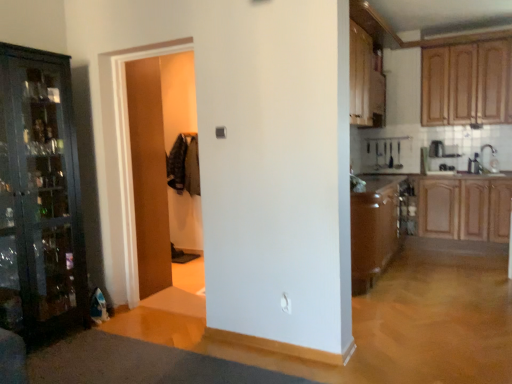
The width and height of the screenshot is (512, 384). In order to click on wooden door at center in this screenshot , I will do `click(149, 175)`.

Based on the photo, measure the distance between point [360,70] and camera.

4.04 meters.

What do you see at coordinates (366, 80) in the screenshot? I see `wooden cabinet at upper right, which is the second cabinetry in top-to-bottom order` at bounding box center [366, 80].

The height and width of the screenshot is (384, 512). What do you see at coordinates (467, 83) in the screenshot?
I see `wooden cabinets at upper right, the third cabinetry ordered from the bottom` at bounding box center [467, 83].

Find the location of a particular element. wooden cabinets at upper right, the third cabinetry ordered from the bottom is located at coordinates (467, 83).

Where is `wooden door at center`? The height and width of the screenshot is (384, 512). wooden door at center is located at coordinates (149, 175).

Is wooden door at center to the left or to the right of wooden cabinet at right, which is counted as the 3th cabinetry, starting from the top, in the image?

Clearly, wooden door at center is on the left of wooden cabinet at right, which is counted as the 3th cabinetry, starting from the top, in the image.

Are wooden door at center and wooden cabinet at right, which is counted as the 3th cabinetry, starting from the top, located far from each other?

Indeed, wooden door at center is not near wooden cabinet at right, which is counted as the 3th cabinetry, starting from the top.

Considering the sizes of objects wooden door at center and wooden cabinet at right, which is counted as the 3th cabinetry, starting from the top, in the image provided, who is shorter, wooden door at center or wooden cabinet at right, which is counted as the 3th cabinetry, starting from the top,?

With less height is wooden cabinet at right, which is counted as the 3th cabinetry, starting from the top.

Based on the photo, from the image's perspective, which object appears higher, wooden door at center or wooden cabinet at right, marked as the first cabinetry in a bottom-to-top arrangement?

wooden door at center, from the image's perspective.

Could you measure the distance between wooden door at center and wooden cabinet at upper right, which is the second cabinetry in top-to-bottom order?

wooden door at center and wooden cabinet at upper right, which is the second cabinetry in top-to-bottom order, are 6.67 feet apart.

From a real-world perspective, between wooden door at center and wooden cabinet at upper right, which is the second cabinetry in top-to-bottom order, who is vertically lower?

wooden door at center is physically lower.

Looking at this image, considering the relative sizes of wooden door at center and wooden cabinet at upper right, marked as the second cabinetry in a bottom-to-top arrangement, in the image provided, is wooden door at center smaller than wooden cabinet at upper right, marked as the second cabinetry in a bottom-to-top arrangement,?

Actually, wooden door at center might be larger than wooden cabinet at upper right, marked as the second cabinetry in a bottom-to-top arrangement.

Is wooden door at center in front of brown laminate counter top at center?

Yes, wooden door at center is closer to the camera.

Considering the positions of points (166, 224) and (402, 175), is point (166, 224) closer to camera compared to point (402, 175)?

Yes, point (166, 224) is closer to viewer.

Considering the sizes of objects wooden door at center and brown laminate counter top at center in the image provided, who is taller, wooden door at center or brown laminate counter top at center?

Standing taller between the two is wooden door at center.

Between wooden door at center and brown laminate counter top at center, which one appears on the left side from the viewer's perspective?

Positioned to the left is wooden door at center.

In the scene shown: Does brown laminate counter top at center touch wooden cabinet at right, which is counted as the 3th cabinetry, starting from the top?

brown laminate counter top at center is not next to wooden cabinet at right, which is counted as the 3th cabinetry, starting from the top, and they're not touching.

Is brown laminate counter top at center to the right of wooden cabinet at right, marked as the first cabinetry in a bottom-to-top arrangement, from the viewer's perspective?

In fact, brown laminate counter top at center is to the left of wooden cabinet at right, marked as the first cabinetry in a bottom-to-top arrangement.

Is brown laminate counter top at center situated inside wooden cabinet at right, marked as the first cabinetry in a bottom-to-top arrangement, or outside?

brown laminate counter top at center lies outside wooden cabinet at right, marked as the first cabinetry in a bottom-to-top arrangement.

Can you confirm if brown laminate counter top at center is wider than wooden cabinet at right, which is counted as the 3th cabinetry, starting from the top?

Incorrect, the width of brown laminate counter top at center does not surpass that of wooden cabinet at right, which is counted as the 3th cabinetry, starting from the top.

From a real-world perspective, does brown laminate counter top at center sit lower than wooden cabinet at upper right, marked as the second cabinetry in a bottom-to-top arrangement?

Yes, from a real-world perspective, brown laminate counter top at center is below wooden cabinet at upper right, marked as the second cabinetry in a bottom-to-top arrangement.

Considering the positions of objects brown laminate counter top at center and wooden cabinet at upper right, which is the second cabinetry in top-to-bottom order, in the image provided, who is more to the right, brown laminate counter top at center or wooden cabinet at upper right, which is the second cabinetry in top-to-bottom order,?

brown laminate counter top at center.

Is brown laminate counter top at center shorter than wooden cabinet at upper right, which is the second cabinetry in top-to-bottom order?

Correct, brown laminate counter top at center is not as tall as wooden cabinet at upper right, which is the second cabinetry in top-to-bottom order.

Is white glossy sink at right beside brown laminate counter top at center?

No, white glossy sink at right is not making contact with brown laminate counter top at center.

Based on the photo, considering the sizes of objects white glossy sink at right and brown laminate counter top at center in the image provided, who is wider, white glossy sink at right or brown laminate counter top at center?

brown laminate counter top at center is wider.

Considering the sizes of objects white glossy sink at right and brown laminate counter top at center in the image provided, who is shorter, white glossy sink at right or brown laminate counter top at center?

Standing shorter between the two is brown laminate counter top at center.

Is white glossy sink at right further to the viewer compared to brown laminate counter top at center?

Yes, white glossy sink at right is further from the camera.

Is wooden cabinets at upper right, the third cabinetry ordered from the bottom, inside the boundaries of wooden cabinet at upper right, marked as the second cabinetry in a bottom-to-top arrangement, or outside?

wooden cabinets at upper right, the third cabinetry ordered from the bottom, is not enclosed by wooden cabinet at upper right, marked as the second cabinetry in a bottom-to-top arrangement.

Considering their positions, is wooden cabinets at upper right, marked as the 1th cabinetry in a top-to-bottom arrangement, located in front of or behind wooden cabinet at upper right, marked as the second cabinetry in a bottom-to-top arrangement?

Clearly, wooden cabinets at upper right, marked as the 1th cabinetry in a top-to-bottom arrangement, is behind wooden cabinet at upper right, marked as the second cabinetry in a bottom-to-top arrangement.

Where is `cabinetry lying above the wooden cabinet at upper right, which is the second cabinetry in top-to-bottom order (from the image's perspective)`? This screenshot has height=384, width=512. cabinetry lying above the wooden cabinet at upper right, which is the second cabinetry in top-to-bottom order (from the image's perspective) is located at coordinates coord(467,83).

At what (x,y) coordinates should I click in order to perform the action: click on cabinetry located below the wooden door at center (from the image's perspective). Please return your answer as a coordinate pair (x, y). This screenshot has height=384, width=512. Looking at the image, I should click on (465, 208).

Locate an element on the screen. door lying in front of the wooden cabinet at upper right, marked as the second cabinetry in a bottom-to-top arrangement is located at coordinates (149, 175).

Which object lies nearer to the anchor point wooden cabinet at right, which is counted as the 3th cabinetry, starting from the top, white glossy sink at right or wooden cabinet at upper right, marked as the second cabinetry in a bottom-to-top arrangement?

The object closer to wooden cabinet at right, which is counted as the 3th cabinetry, starting from the top, is white glossy sink at right.

Based on their spatial positions, is wooden door at center or brown laminate counter top at center further from wooden cabinet at right, marked as the first cabinetry in a bottom-to-top arrangement?

wooden door at center is further to wooden cabinet at right, marked as the first cabinetry in a bottom-to-top arrangement.

Which object lies further to the anchor point wooden cabinets at upper right, the third cabinetry ordered from the bottom, wooden door at center or wooden cabinet at upper right, marked as the second cabinetry in a bottom-to-top arrangement?

wooden door at center.

Considering their positions, is wooden cabinet at right, marked as the first cabinetry in a bottom-to-top arrangement, positioned further to white glossy sink at right than brown laminate counter top at center?

Based on the image, brown laminate counter top at center appears to be further to white glossy sink at right.

Estimate the real-world distances between objects in this image. Which object is further from wooden door at center, wooden cabinet at right, which is counted as the 3th cabinetry, starting from the top, or brown laminate counter top at center?

wooden cabinet at right, which is counted as the 3th cabinetry, starting from the top, is positioned further to the anchor wooden door at center.

Considering their positions, is wooden cabinets at upper right, marked as the 1th cabinetry in a top-to-bottom arrangement, positioned closer to wooden cabinet at right, marked as the first cabinetry in a bottom-to-top arrangement, than white glossy sink at right?

white glossy sink at right is closer to wooden cabinet at right, marked as the first cabinetry in a bottom-to-top arrangement.

Based on their spatial positions, is wooden cabinets at upper right, the third cabinetry ordered from the bottom, or wooden door at center closer to wooden cabinet at upper right, marked as the second cabinetry in a bottom-to-top arrangement?

Based on the image, wooden cabinets at upper right, the third cabinetry ordered from the bottom, appears to be nearer to wooden cabinet at upper right, marked as the second cabinetry in a bottom-to-top arrangement.

From the image, which object appears to be farther from white glossy sink at right, wooden cabinets at upper right, the third cabinetry ordered from the bottom, or wooden door at center?

wooden door at center.

Where is `counter top situated between wooden cabinet at upper right, which is the second cabinetry in top-to-bottom order, and wooden cabinet at right, which is counted as the 3th cabinetry, starting from the top, from left to right`? This screenshot has width=512, height=384. counter top situated between wooden cabinet at upper right, which is the second cabinetry in top-to-bottom order, and wooden cabinet at right, which is counted as the 3th cabinetry, starting from the top, from left to right is located at coordinates (380, 181).

You are a GUI agent. You are given a task and a screenshot of the screen. Output one action in this format:
    pyautogui.click(x=<x>, y=<y>)
    Task: Click on the counter top located between wooden door at center and wooden cabinets at upper right, marked as the 1th cabinetry in a top-to-bottom arrangement, in the left-right direction
    The height and width of the screenshot is (384, 512).
    Given the screenshot: What is the action you would take?
    pyautogui.click(x=380, y=181)

Where is `cabinetry between wooden door at center and brown laminate counter top at center in the horizontal direction`? This screenshot has width=512, height=384. cabinetry between wooden door at center and brown laminate counter top at center in the horizontal direction is located at coordinates (366, 80).

I want to click on counter top situated between wooden cabinet at upper right, marked as the second cabinetry in a bottom-to-top arrangement, and wooden cabinets at upper right, the third cabinetry ordered from the bottom, from left to right, so click(380, 181).